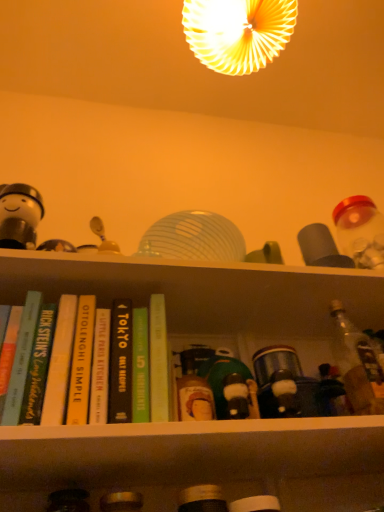
In order to face matte plastic bottles at center, should I rotate leftwards or rightwards?

To align with it, rotate right about 5.097°.

Measure the distance between matte yellow lampshade at upper center and camera.

A distance of 1.17 meters exists between matte yellow lampshade at upper center and camera.

Measure the distance between clear glass bottle at right, which is the third bottle from bottom to top, and camera.

A: A distance of 34.24 inches exists between clear glass bottle at right, which is the third bottle from bottom to top, and camera.

Consider the image. How much space does matte black bottle at lower center, arranged as the 2th bottle when viewed from the left, occupy vertically?

It is 5.97 inches.

Measure the distance between hardcover book at left, arranged as the second book when viewed from the left, and camera.

A distance of 25.78 inches exists between hardcover book at left, arranged as the second book when viewed from the left, and camera.

In order to click on white matte figurine at left in this screenshot , I will do `click(19, 216)`.

What are the coordinates of `matte plastic bottles at center` in the screenshot? It's located at (200, 461).

From the image's perspective, between green matte book at center, the first book when ordered from right to left, and white matte figurine at left, which one is located above?

white matte figurine at left is shown above in the image.

Considering the positions of objects green matte book at center, the first book when ordered from right to left, and white matte figurine at left in the image provided, who is behind, green matte book at center, the first book when ordered from right to left, or white matte figurine at left?

white matte figurine at left is more distant.

Which is in front, point (160, 316) or point (0, 199)?

The point (160, 316) is more forward.

Is green matte book at center, the 5th book from the left, in contact with white matte figurine at left?

No, green matte book at center, the 5th book from the left, is not with white matte figurine at left.

Between matte black bottle at lower center, marked as the 2th bottle in a right-to-left arrangement, and hardcover book at center, the 3th book when ordered from right to left, which one has less height?

matte black bottle at lower center, marked as the 2th bottle in a right-to-left arrangement, is shorter.

In terms of size, does matte black bottle at lower center, marked as the 2th bottle in a right-to-left arrangement, appear bigger or smaller than hardcover book at center, which is the third book in left-to-right order?

Clearly, matte black bottle at lower center, marked as the 2th bottle in a right-to-left arrangement, is larger in size than hardcover book at center, which is the third book in left-to-right order.

From the picture: Is matte black bottle at lower center, marked as the 2th bottle in a right-to-left arrangement, positioned beyond the bounds of hardcover book at center, which is the third book in left-to-right order?

Yes, matte black bottle at lower center, marked as the 2th bottle in a right-to-left arrangement, is outside of hardcover book at center, which is the third book in left-to-right order.

Considering the positions of objects matte black bottle at lower center, the 2th bottle when ordered from bottom to top, and hardcover book at center, the 3th book when ordered from right to left, in the image provided, who is more to the right, matte black bottle at lower center, the 2th bottle when ordered from bottom to top, or hardcover book at center, the 3th book when ordered from right to left,?

matte black bottle at lower center, the 2th bottle when ordered from bottom to top, is more to the right.

How many degrees apart are the facing directions of green matte book at center, the first book when ordered from right to left, and matte black bottle at lower left, placed as the 1th bottle when sorted from left to right?

The angular difference between green matte book at center, the first book when ordered from right to left, and matte black bottle at lower left, placed as the 1th bottle when sorted from left to right, is 2.12 degrees.

Looking at this image, between green matte book at center, the 5th book from the left, and matte black bottle at lower left, placed as the third bottle when sorted from top to bottom, which one has smaller width?

Thinner between the two is matte black bottle at lower left, placed as the third bottle when sorted from top to bottom.

Is green matte book at center, the 5th book from the left, positioned far away from matte black bottle at lower left, the first bottle ordered from the bottom?

No, green matte book at center, the 5th book from the left, is not far from matte black bottle at lower left, the first bottle ordered from the bottom.

Does green matte book at center, the 5th book from the left, turn towards matte black bottle at lower left, placed as the 1th bottle when sorted from left to right?

No.

Can you tell me how much matte plastic bottles at center and black hardcover book at center, the 2th book viewed from the right, differ in facing direction?

The angle between the facing direction of matte plastic bottles at center and the facing direction of black hardcover book at center, the 2th book viewed from the right, is 1.45 degrees.

Visually, is matte plastic bottles at center positioned to the left or to the right of black hardcover book at center, the 2th book viewed from the right?

matte plastic bottles at center is to the right of black hardcover book at center, the 2th book viewed from the right.

In terms of width, does matte plastic bottles at center look wider or thinner when compared to black hardcover book at center, which is the fourth book in left-to-right order?

matte plastic bottles at center is wider than black hardcover book at center, which is the fourth book in left-to-right order.

From the image's perspective, between matte black bottle at lower center, the 2th bottle positioned from the top, and hardcover book at left, the fourth book from the right, which one is located above?

hardcover book at left, the fourth book from the right.

Is matte black bottle at lower center, the 2th bottle when ordered from bottom to top, next to hardcover book at left, arranged as the second book when viewed from the left, and touching it?

No, matte black bottle at lower center, the 2th bottle when ordered from bottom to top, is not next to hardcover book at left, arranged as the second book when viewed from the left.

Which is more to the right, matte black bottle at lower center, arranged as the 2th bottle when viewed from the left, or hardcover book at left, arranged as the second book when viewed from the left?

matte black bottle at lower center, arranged as the 2th bottle when viewed from the left, is more to the right.

Which is behind, point (19, 236) or point (158, 378)?

The point (19, 236) is more distant.

From a real-world perspective, is white matte figurine at left physically below green matte book at center, the 5th book from the left?

No, from a real-world perspective, white matte figurine at left is not beneath green matte book at center, the 5th book from the left.

Is white matte figurine at left facing away from green matte book at center, the first book when ordered from right to left?

No, white matte figurine at left's orientation is not away from green matte book at center, the first book when ordered from right to left.

Does white matte figurine at left have a greater width compared to green matte book at center, the 5th book from the left?

No, white matte figurine at left is not wider than green matte book at center, the 5th book from the left.

From a real-world perspective, is matte yellow lampshade at upper center positioned above or below hardcover book at center, the 3th book when ordered from right to left?

matte yellow lampshade at upper center is situated higher than hardcover book at center, the 3th book when ordered from right to left, in the real world.

Is matte yellow lampshade at upper center not within hardcover book at center, which is the third book in left-to-right order?

matte yellow lampshade at upper center lies outside hardcover book at center, which is the third book in left-to-right order,'s area.

Which object is more forward, matte yellow lampshade at upper center or hardcover book at center, which is the third book in left-to-right order?

hardcover book at center, which is the third book in left-to-right order.

Is matte yellow lampshade at upper center bigger than hardcover book at center, which is the third book in left-to-right order?

Correct, matte yellow lampshade at upper center is larger in size than hardcover book at center, which is the third book in left-to-right order.

I want to click on the 1st book in front of the white matte figurine at left, so click(x=158, y=360).

Identify the location of bottle that is the 1st object to the right of the hardcover book at center, the 3th book when ordered from right to left, starting at the anchor. (202, 499).

When comparing their distances from matte black bottle at lower center, the 2th bottle positioned from the top, does hardcover book at left, arranged as the second book when viewed from the left, or white matte figurine at left seem closer?

hardcover book at left, arranged as the second book when viewed from the left, is positioned closer to the anchor matte black bottle at lower center, the 2th bottle positioned from the top.

From the image, which object appears to be farther from white matte figurine at left, matte yellow lampshade at upper center or hardcover book at center, which is the third book in left-to-right order?

matte yellow lampshade at upper center is further to white matte figurine at left.

When comparing their distances from matte yellow lampshade at upper center, does white matte figurine at left or clear glass bottle at right, which is the third bottle from bottom to top, seem closer?

white matte figurine at left is positioned closer to the anchor matte yellow lampshade at upper center.

Estimate the real-world distances between objects in this image. Which object is further from hardcover book at left, the first book positioned from the left, hardcover book at left, arranged as the second book when viewed from the left, or white matte figurine at left?

white matte figurine at left is further to hardcover book at left, the first book positioned from the left.

Looking at the image, which one is located closer to white matte figurine at left, black hardcover book at center, the 2th book viewed from the right, or matte black bottle at lower left, placed as the 1th bottle when sorted from left to right?

Among the two, black hardcover book at center, the 2th book viewed from the right, is located nearer to white matte figurine at left.

Estimate the real-world distances between objects in this image. Which object is further from matte yellow lampshade at upper center, black hardcover book at center, which is the fourth book in left-to-right order, or hardcover book at left, the first book positioned from the left?

Based on the image, hardcover book at left, the first book positioned from the left, appears to be further to matte yellow lampshade at upper center.

Considering their positions, is matte yellow lampshade at upper center positioned further to white matte figurine at left than green matte book at center, the 5th book from the left?

matte yellow lampshade at upper center is further to white matte figurine at left.

Estimate the real-world distances between objects in this image. Which object is closer to matte black bottle at lower center, the 2th bottle positioned from the top, black hardcover book at center, the 2th book viewed from the right, or clear glass bottle at right, the 3th bottle positioned from the left?

black hardcover book at center, the 2th book viewed from the right, is positioned closer to the anchor matte black bottle at lower center, the 2th bottle positioned from the top.

Image resolution: width=384 pixels, height=512 pixels. In order to click on bottle between hardcover book at center, the 3th book when ordered from right to left, and matte black bottle at lower left, the first bottle ordered from the bottom, from top to bottom in this screenshot , I will do `click(202, 499)`.

The width and height of the screenshot is (384, 512). Find the location of `book between hardcover book at left, the fourth book from the right, and black hardcover book at center, which is the fourth book in left-to-right order, from left to right`. book between hardcover book at left, the fourth book from the right, and black hardcover book at center, which is the fourth book in left-to-right order, from left to right is located at coordinates (100, 368).

Locate an element on the screen. shelf that lies between white matte figurine at left and matte black bottle at lower center, the 2th bottle positioned from the top, from top to bottom is located at coordinates pos(200,461).

Locate an element on the screen. The height and width of the screenshot is (512, 384). book between black hardcover book at center, which is the fourth book in left-to-right order, and matte black bottle at lower center, marked as the 2th bottle in a right-to-left arrangement, vertically is located at coordinates (158, 360).